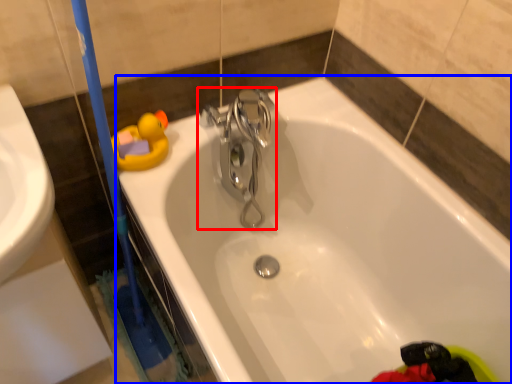
Question: Among these objects, which one is farthest to the camera, tap (highlighted by a red box) or bathtub (highlighted by a blue box)?

Choices:
 (A) tap
 (B) bathtub

Answer: (A)